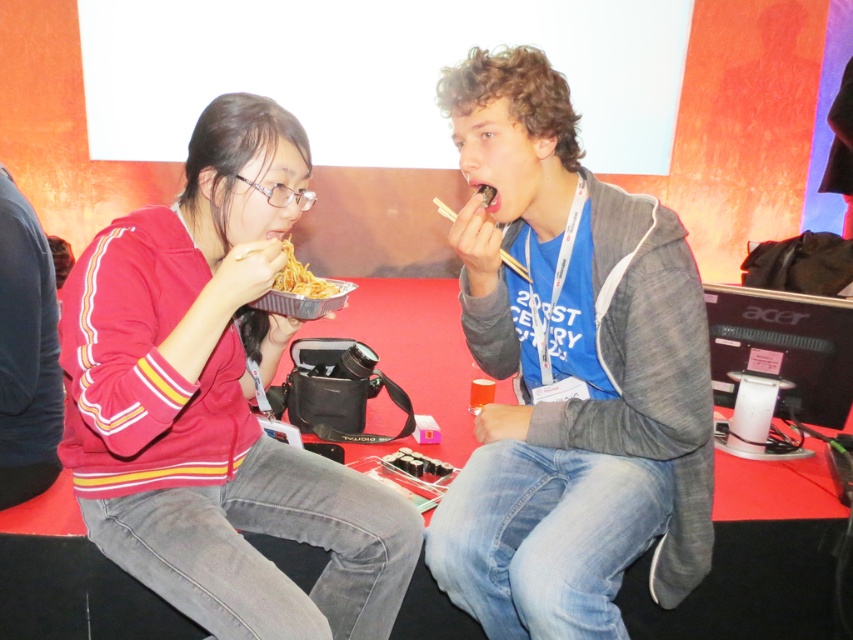
In the scene shown: Is shiny metallic noodles at center taller than wooden chopsticks at upper center?

No.

Between shiny metallic noodles at center and wooden chopsticks at upper center, which one appears on the left side from the viewer's perspective?

shiny metallic noodles at center is more to the left.

Which is behind, point (291, 248) or point (517, 262)?

The point (291, 248) is more distant.

I want to click on shiny metallic noodles at center, so click(300, 276).

Does point (560, 131) come behind point (520, 272)?

No, it is not.

At what (x,y) coordinates should I click in order to perform the action: click on gray fleece jacket at center. Please return your answer as a coordinate pair (x, y). This screenshot has height=640, width=853. Looking at the image, I should click on pyautogui.click(x=569, y=372).

Is point (492, 260) positioned behind point (437, 200)?

No, (492, 260) is closer to viewer.

The height and width of the screenshot is (640, 853). Identify the location of gray fleece jacket at center. (569, 372).

Can you confirm if matte red sweater at center is positioned to the left of wooden chopsticks at upper center?

Yes, matte red sweater at center is to the left of wooden chopsticks at upper center.

Is matte red sweater at center smaller than wooden chopsticks at upper center?

Actually, matte red sweater at center might be larger than wooden chopsticks at upper center.

Who is more distant from viewer, (415, 531) or (439, 211)?

Point (439, 211)

Where is `matte red sweater at center`? Image resolution: width=853 pixels, height=640 pixels. matte red sweater at center is located at coordinates (216, 403).